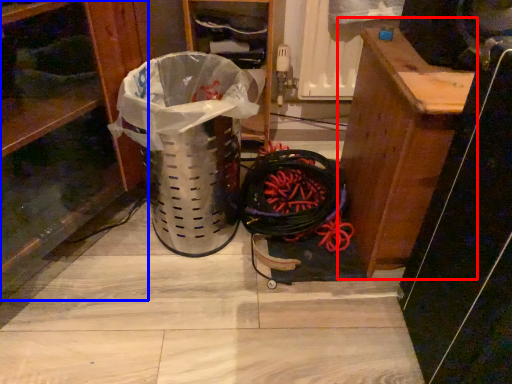
Question: Which object appears closest to the camera in this image, furniture (highlighted by a red box) or shelf (highlighted by a blue box)?

Choices:
 (A) furniture
 (B) shelf

Answer: (B)